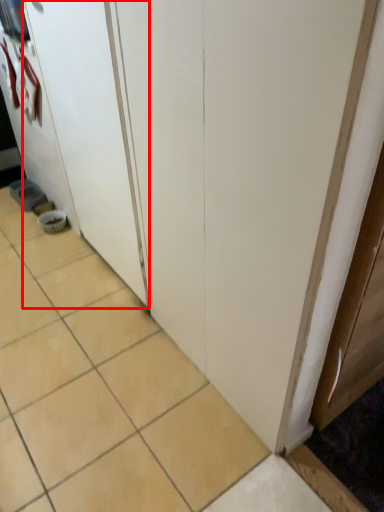
Question: In this image, where is screen door (annotated by the red box) located relative to ceramic tile?

Choices:
 (A) right
 (B) left

Answer: (A)